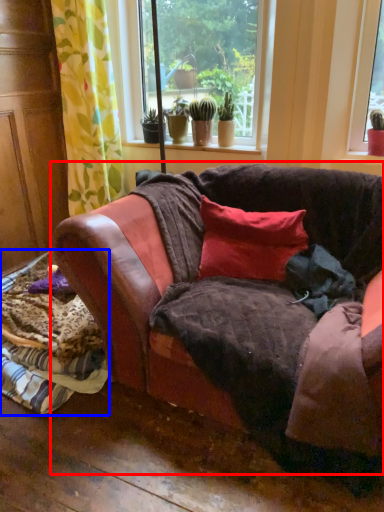
Question: Which object appears closest to the camera in this image, studio couch (highlighted by a red box) or material (highlighted by a blue box)?

Choices:
 (A) studio couch
 (B) material

Answer: (A)